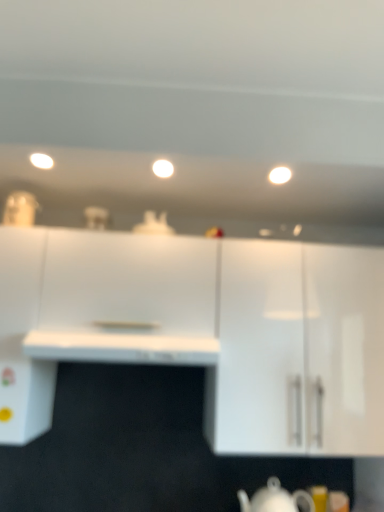
Question: Is white glossy light at upper center, which is counted as the 3th lighting, starting from the left, wider than white glossy cabinet at upper right, marked as the 1th cabinetry in a right-to-left arrangement?

Choices:
 (A) yes
 (B) no

Answer: (B)

Question: From the image's perspective, would you say white glossy light at upper center, marked as the first lighting in a right-to-left arrangement, is shown under white glossy cabinet at upper right, marked as the 1th cabinetry in a right-to-left arrangement?

Choices:
 (A) yes
 (B) no

Answer: (B)

Question: Could you tell me if white glossy light at upper center, which is counted as the 3th lighting, starting from the left, is facing white glossy cabinet at upper right, marked as the 1th cabinetry in a right-to-left arrangement?

Choices:
 (A) yes
 (B) no

Answer: (B)

Question: Considering the relative sizes of white glossy light at upper center, which is counted as the 3th lighting, starting from the left, and white glossy cabinet at upper right, the second cabinetry viewed from the left, in the image provided, is white glossy light at upper center, which is counted as the 3th lighting, starting from the left, smaller than white glossy cabinet at upper right, the second cabinetry viewed from the left,?

Choices:
 (A) yes
 (B) no

Answer: (A)

Question: From a real-world perspective, is white glossy light at upper center, marked as the first lighting in a right-to-left arrangement, positioned over white glossy cabinet at upper right, marked as the 1th cabinetry in a right-to-left arrangement, based on gravity?

Choices:
 (A) no
 (B) yes

Answer: (B)

Question: Does white glossy light at upper center, marked as the first lighting in a right-to-left arrangement, appear on the left side of white glossy cabinet at upper right, marked as the 1th cabinetry in a right-to-left arrangement?

Choices:
 (A) no
 (B) yes

Answer: (B)

Question: From a real-world perspective, does white glossy light at upper center, which is counted as the 3th lighting, starting from the left, stand above white glossy light fixture at upper left, the 3th lighting when ordered from right to left?

Choices:
 (A) no
 (B) yes

Answer: (B)

Question: From the image's perspective, is white glossy light at upper center, marked as the first lighting in a right-to-left arrangement, located above white glossy light fixture at upper left, the 3th lighting when ordered from right to left?

Choices:
 (A) no
 (B) yes

Answer: (A)

Question: From a real-world perspective, is white glossy light at upper center, which is counted as the 3th lighting, starting from the left, positioned under white glossy light fixture at upper left, which is the first lighting from left to right, based on gravity?

Choices:
 (A) no
 (B) yes

Answer: (A)

Question: Is white glossy light at upper center, which is counted as the 3th lighting, starting from the left, outside of white glossy light fixture at upper left, which is the first lighting from left to right?

Choices:
 (A) yes
 (B) no

Answer: (A)

Question: Does white glossy light at upper center, marked as the first lighting in a right-to-left arrangement, turn towards white glossy light fixture at upper left, the 3th lighting when ordered from right to left?

Choices:
 (A) no
 (B) yes

Answer: (A)

Question: Is white glossy light at upper center, which is counted as the 3th lighting, starting from the left, to the left of white glossy light fixture at upper left, the 3th lighting when ordered from right to left, from the viewer's perspective?

Choices:
 (A) yes
 (B) no

Answer: (B)

Question: Is white glossy teapot at lower center further to the viewer compared to white glossy cabinet at upper right, the second cabinetry viewed from the left?

Choices:
 (A) no
 (B) yes

Answer: (A)